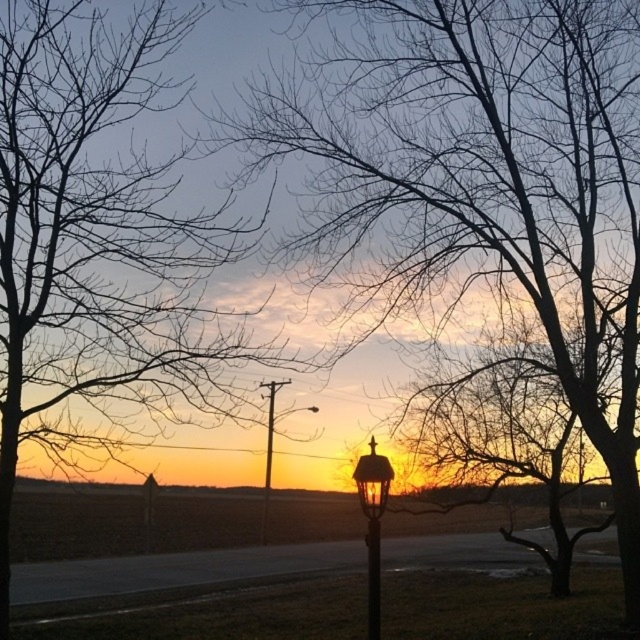
You are a painter setting up your easel to capture the scene. You want to emphasize the contrast between the silhouette bare tree at left and the metallic streetlamp at center. Which object should you focus on to highlight its size difference?

The silhouette bare tree at left is bigger than the metallic streetlamp at center, so focusing on the silhouette bare tree at left would emphasize its larger size compared to the metallic streetlamp at center.